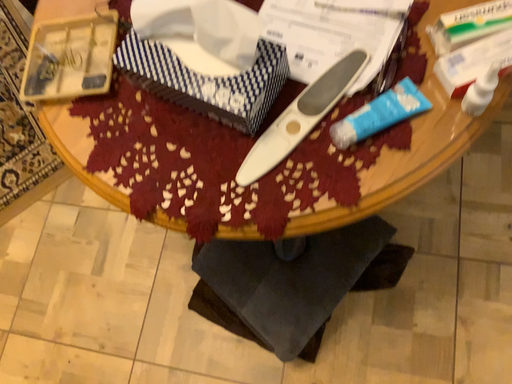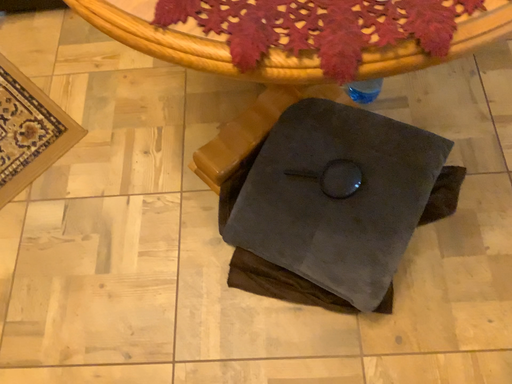
Question: How did the camera likely rotate when shooting the video?

Choices:
 (A) rotated left
 (B) rotated right

Answer: (B)